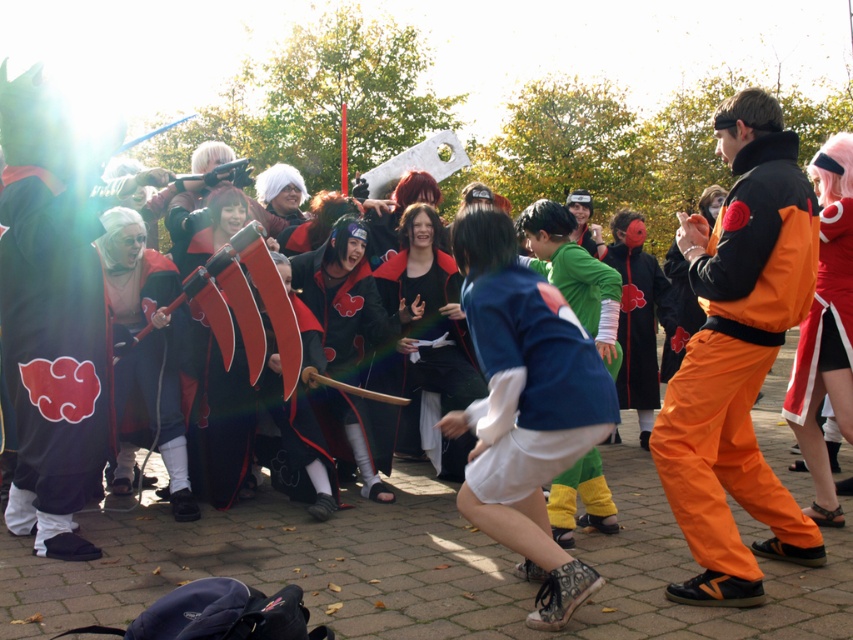
You are a photographer at the cosplay event. You want to take a photo that includes both the orange cotton pants at right and the white cotton shirt at center. Based on their positions, which character should be positioned to the left in the photo?

The white cotton shirt at center should be positioned to the left in the photo because the orange cotton pants at right is to the right of it.

You are standing at the center of the paved area and want to take a photo of the orange cotton pants at right. Which direction should you face to capture it in your camera view?

The orange cotton pants at right is located at point 0.558 on the x axis and 0.866 on the y axis, so you should face towards the right side of the scene to capture it in your camera view.